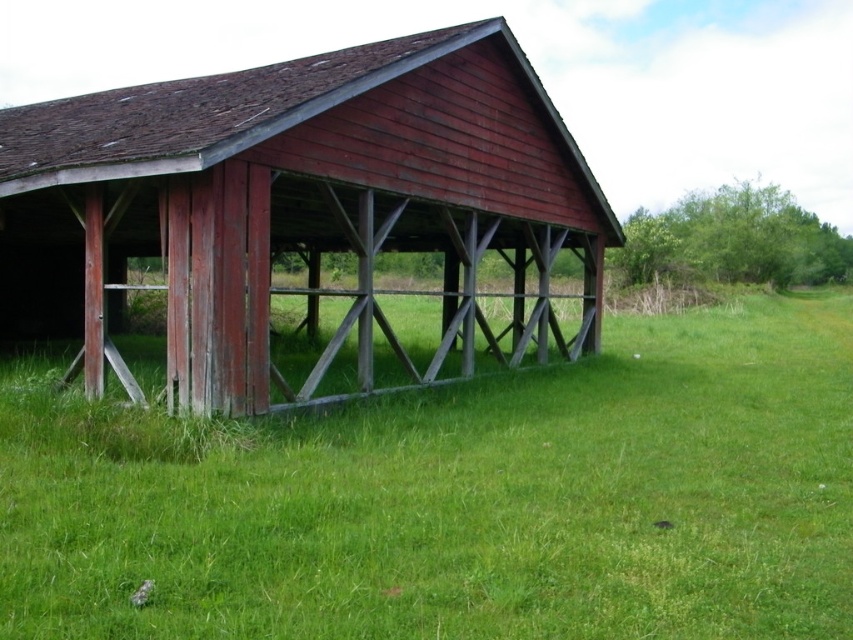
Which is more to the right, green grass at lower left or matte wood barn at center?

green grass at lower left

Describe the element at coordinates (457, 499) in the screenshot. This screenshot has width=853, height=640. I see `green grass at lower left` at that location.

Where is `green grass at lower left`? Image resolution: width=853 pixels, height=640 pixels. green grass at lower left is located at coordinates (457, 499).